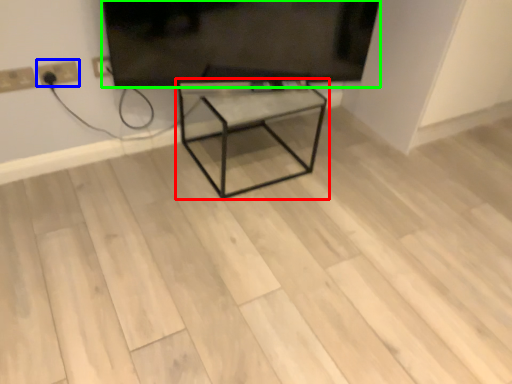
Question: Which object is the closest to the table (highlighted by a red box)? Choose among these: electric outlet (highlighted by a blue box) or television (highlighted by a green box).

Choices:
 (A) electric outlet
 (B) television

Answer: (B)